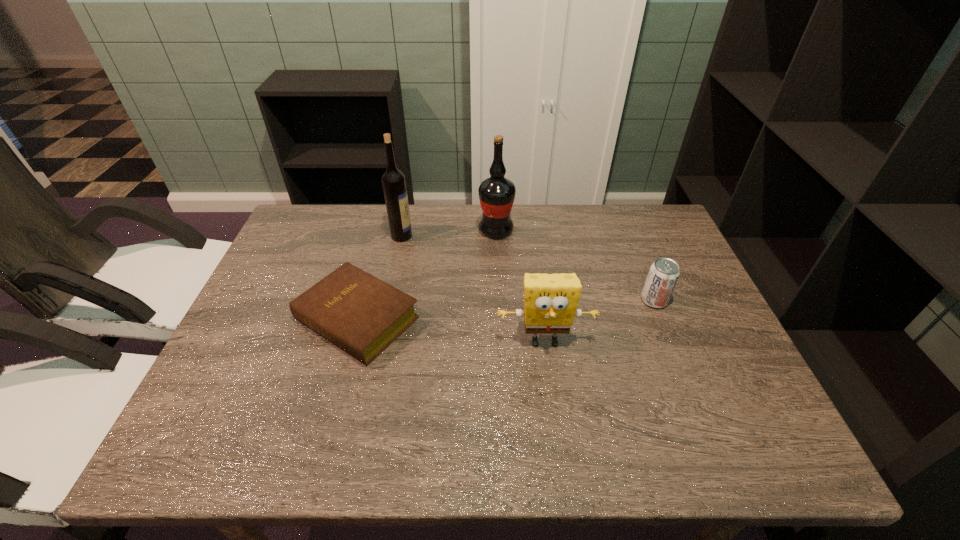
Identify the location of blank area located on the right of the shortest object. The height and width of the screenshot is (540, 960). (503, 319).

Where is `object positioned at the left edge`? The height and width of the screenshot is (540, 960). object positioned at the left edge is located at coordinates coord(362,315).

The width and height of the screenshot is (960, 540). I want to click on object present at the right edge, so click(663, 275).

Where is `vacant region at the far edge of the desktop`? The image size is (960, 540). vacant region at the far edge of the desktop is located at coordinates (623, 244).

This screenshot has width=960, height=540. I want to click on vacant space at the near edge, so click(311, 443).

Where is `vacant space at the left edge of the desktop`? The width and height of the screenshot is (960, 540). vacant space at the left edge of the desktop is located at coordinates click(x=276, y=282).

Where is `vacant space at the right edge`? This screenshot has height=540, width=960. vacant space at the right edge is located at coordinates (654, 252).

Where is `blank area at the far left corner`? The height and width of the screenshot is (540, 960). blank area at the far left corner is located at coordinates (300, 213).

The image size is (960, 540). What are the coordinates of `vacant space at the near left corner of the desktop` in the screenshot? It's located at (178, 457).

What are the coordinates of `vacant region at the far right corner of the desktop` in the screenshot? It's located at coord(624,231).